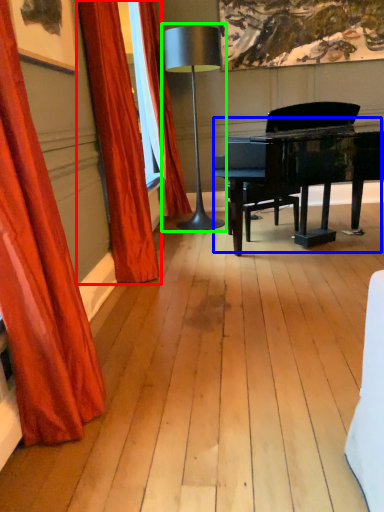
Question: Estimate the real-world distances between objects in this image. Which object is closer to curtain (highlighted by a red box), piano (highlighted by a blue box) or table lamp (highlighted by a green box)?

Choices:
 (A) piano
 (B) table lamp

Answer: (A)